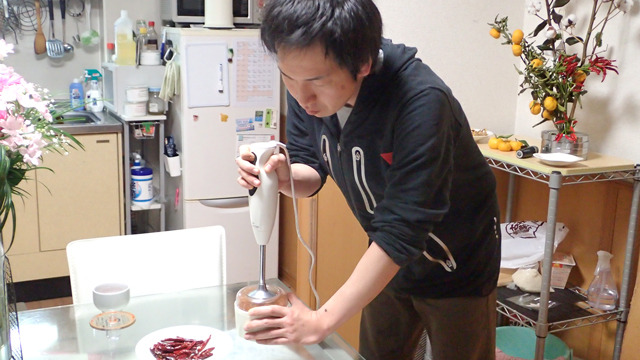
This screenshot has height=360, width=640. I want to click on table, so click(x=188, y=299).